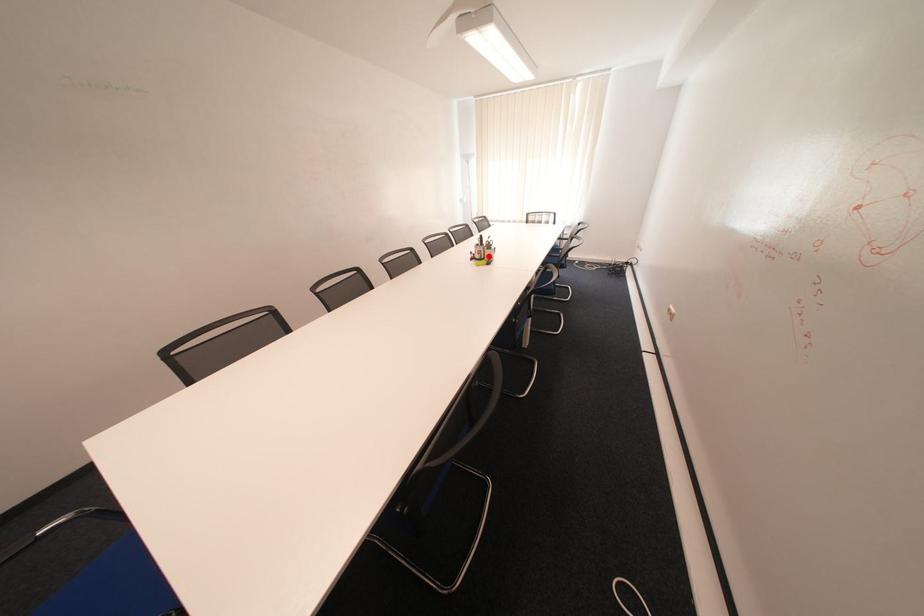
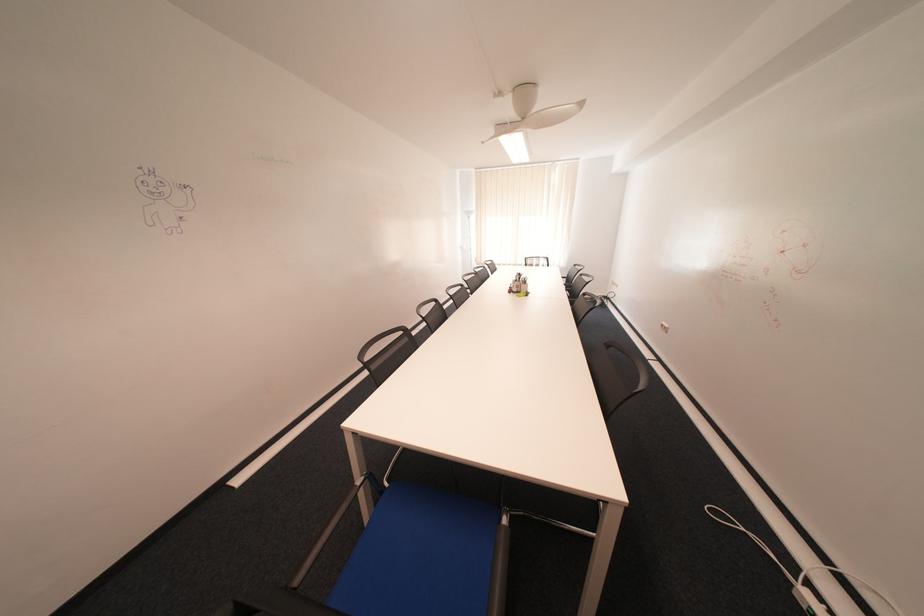
The point at the highlighted location is marked in the first image. Where is the corresponding point in the second image?

(526, 290)